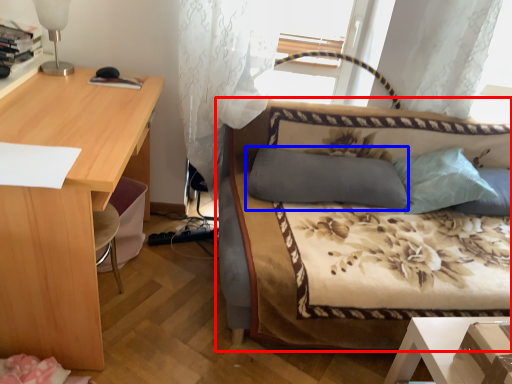
Question: Which of the following is the closest to the observer, studio couch (highlighted by a red box) or pillow (highlighted by a blue box)?

Choices:
 (A) studio couch
 (B) pillow

Answer: (A)